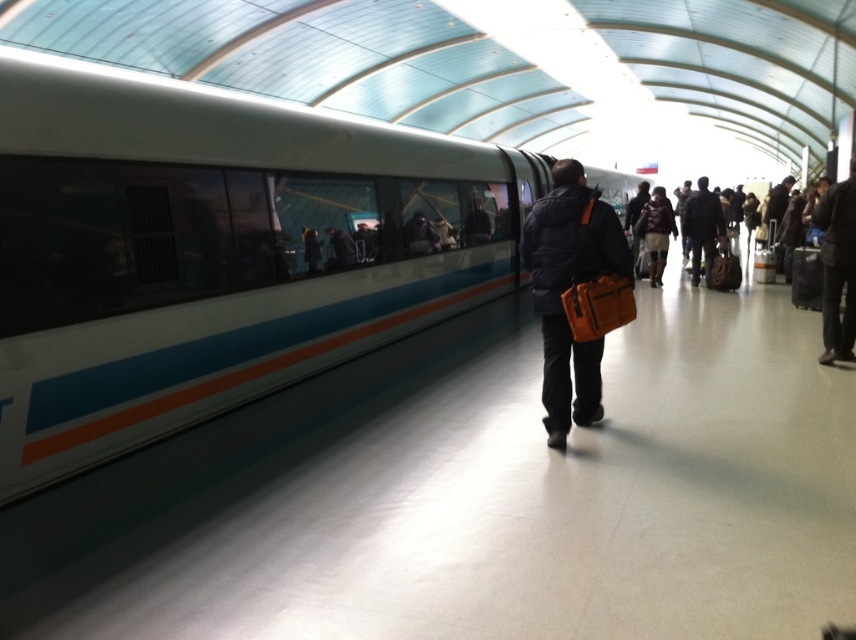
You are standing on the platform and see two jackets hanging on a rack. The jackets are the matte black jacket at center and the dark brown leather jacket at center. Which jacket is hanging lower on the rack?

The matte black jacket at center is positioned under the dark brown leather jacket at center, so it is hanging lower on the rack.